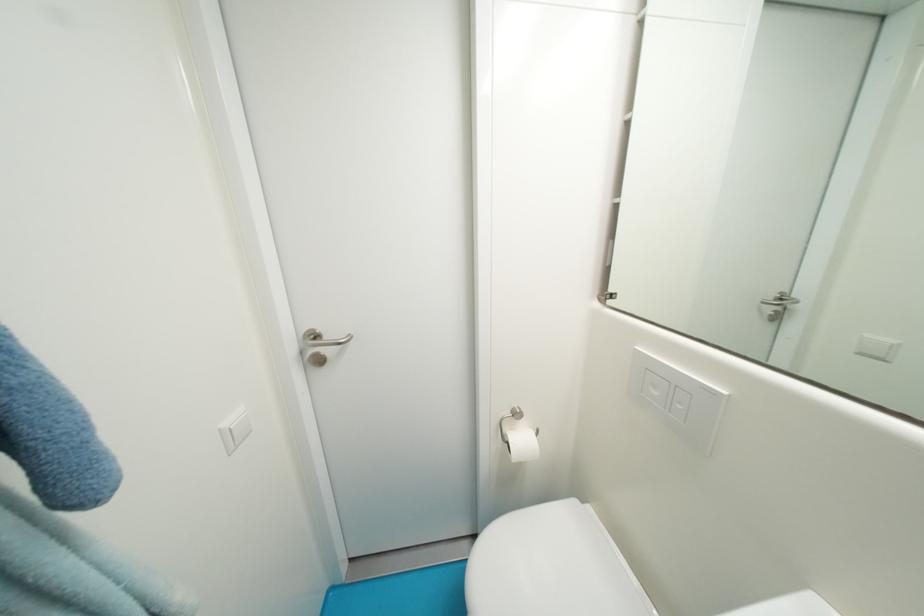
Where would you turn the metal door handle? Please return your answer as a coordinate pair (x, y).

(322, 339)